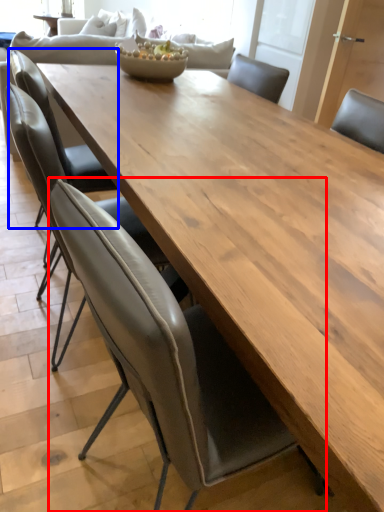
Question: Which object is further to the camera taking this photo, chair (highlighted by a red box) or chair (highlighted by a blue box)?

Choices:
 (A) chair
 (B) chair

Answer: (B)